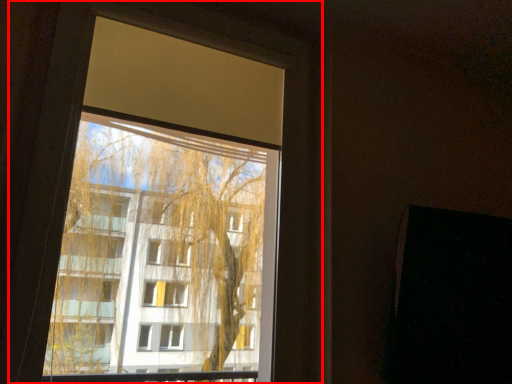
Question: From the image, what is the correct spatial relationship of window (annotated by the red box) in relation to screen door?

Choices:
 (A) left
 (B) right

Answer: (A)